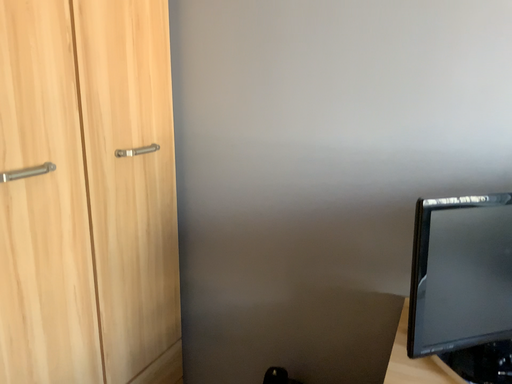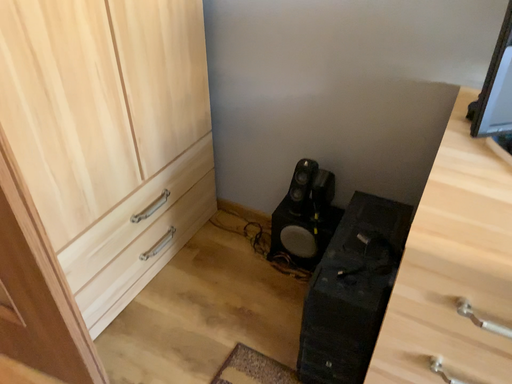
Question: How did the camera likely rotate when shooting the video?

Choices:
 (A) rotated upward
 (B) rotated downward

Answer: (B)